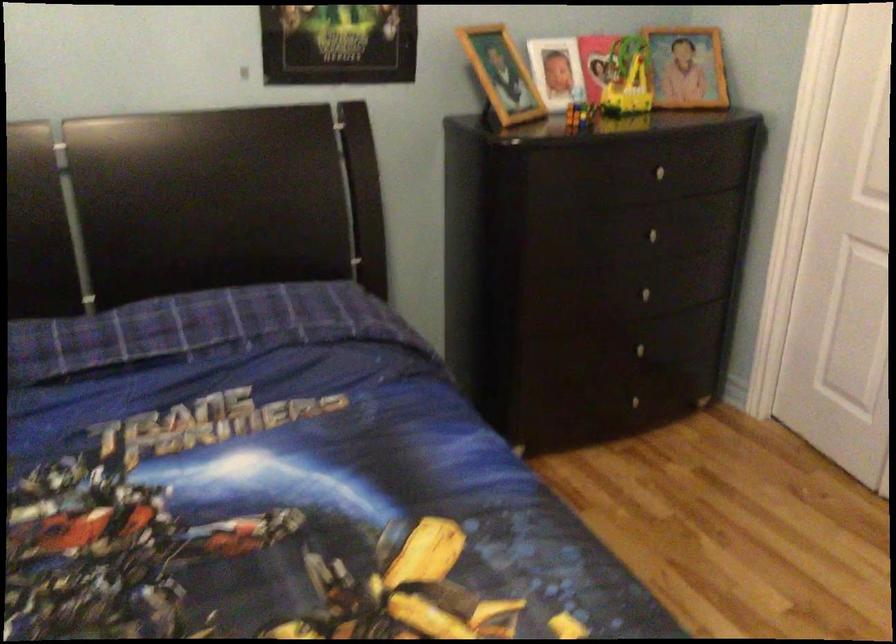
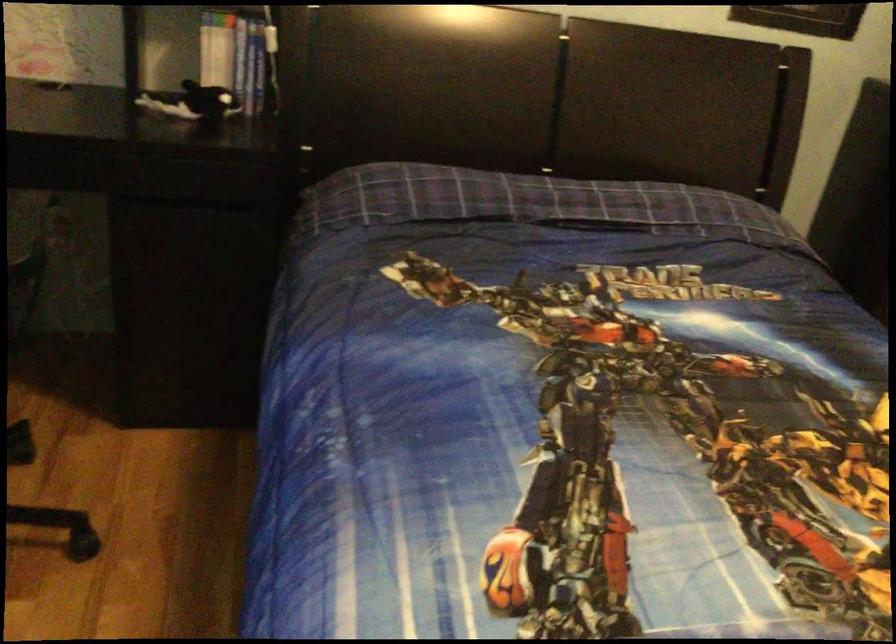
The images are taken continuously from a first-person perspective. In which direction are you moving?

The movement direction of the cameraman is left, backward.